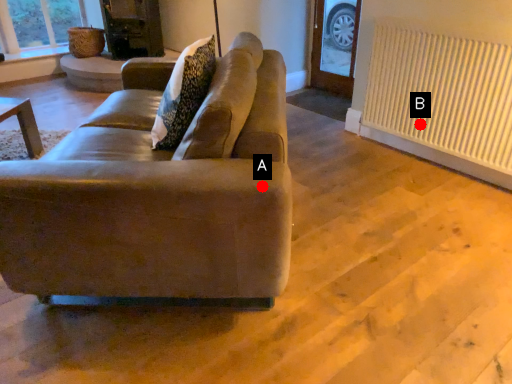
Question: Two points are circled on the image, labeled by A and B beside each circle. Among these points, which one is nearest to the camera?

Choices:
 (A) A is closer
 (B) B is closer

Answer: (A)